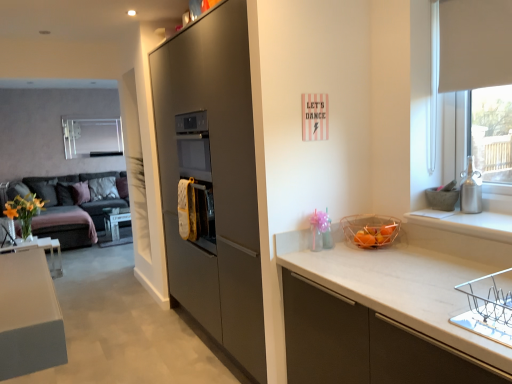
Question: In terms of height, does translucent plastic basket at right look taller or shorter compared to yellow matte vase at left?

Choices:
 (A) short
 (B) tall

Answer: (A)

Question: Is point (394, 221) positioned closer to the camera than point (7, 213)?

Choices:
 (A) farther
 (B) closer

Answer: (B)

Question: Estimate the real-world distances between objects in this image. Which object is farther from the matte gray cabinet at center?

Choices:
 (A) satin silver vase at right
 (B) matte gray pillow at left, placed as the 1th pillow when sorted from left to right
 (C) yellow matte vase at left
 (D) translucent plastic basket at right
 (E) dark gray fabric couch at left

Answer: (B)

Question: Which object is positioned closest to the dark gray fabric couch at left?

Choices:
 (A) matte gray cabinet at center
 (B) matte gray pillow at left, which is counted as the 2th pillow, starting from the right
 (C) yellow matte vase at left
 (D) white fabric pillow at left, which is the 2th pillow from left to right
 (E) translucent plastic basket at right

Answer: (B)